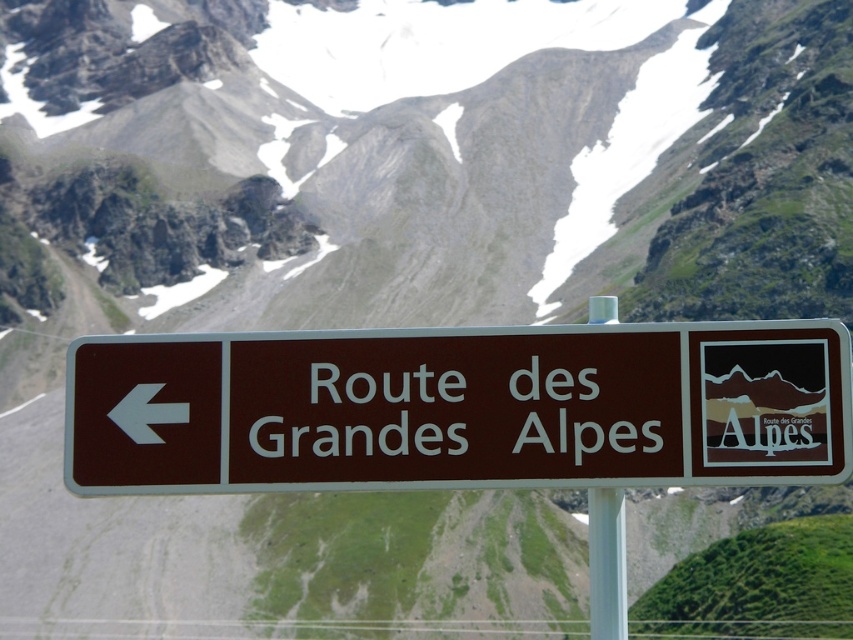
Question: Where is brown plastic sign at center located in relation to white plastic pole at center in the image?

Choices:
 (A) left
 (B) right

Answer: (A)

Question: Does brown plastic sign at center appear on the left side of white plastic pole at center?

Choices:
 (A) yes
 (B) no

Answer: (A)

Question: Can you confirm if brown plastic sign at center is smaller than white plastic pole at center?

Choices:
 (A) yes
 (B) no

Answer: (A)

Question: Which object appears closest to the camera in this image?

Choices:
 (A) brown plastic sign at center
 (B) white plastic pole at center

Answer: (A)